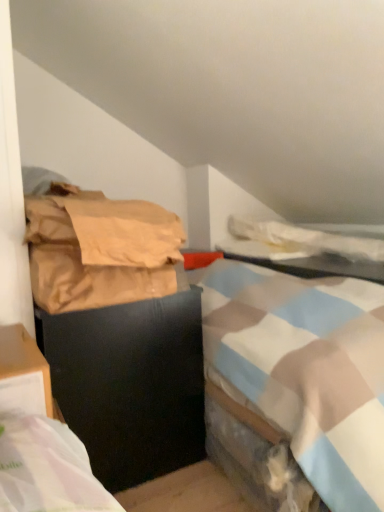
Question: Considering the relative sizes of black matte trash can at left and matte plastic table at center in the image provided, is black matte trash can at left wider than matte plastic table at center?

Choices:
 (A) yes
 (B) no

Answer: (B)

Question: Does black matte trash can at left have a greater height compared to matte plastic table at center?

Choices:
 (A) yes
 (B) no

Answer: (A)

Question: Does black matte trash can at left have a larger size compared to matte plastic table at center?

Choices:
 (A) yes
 (B) no

Answer: (A)

Question: Can you confirm if black matte trash can at left is positioned to the right of matte plastic table at center?

Choices:
 (A) no
 (B) yes

Answer: (A)

Question: From the image's perspective, is black matte trash can at left on matte plastic table at center?

Choices:
 (A) yes
 (B) no

Answer: (B)

Question: Is black matte trash can at left inside or outside of matte plastic table at center?

Choices:
 (A) outside
 (B) inside

Answer: (A)

Question: From a real-world perspective, relative to matte plastic table at center, is black matte trash can at left vertically above or below?

Choices:
 (A) below
 (B) above

Answer: (A)

Question: From the image's perspective, is black matte trash can at left positioned above or below matte plastic table at center?

Choices:
 (A) below
 (B) above

Answer: (A)

Question: Looking at the image, does black matte trash can at left seem bigger or smaller compared to matte plastic table at center?

Choices:
 (A) big
 (B) small

Answer: (A)

Question: Is white soft blanket at upper right wider or thinner than matte plastic table at center?

Choices:
 (A) thin
 (B) wide

Answer: (B)

Question: In terms of height, does white soft blanket at upper right look taller or shorter compared to matte plastic table at center?

Choices:
 (A) tall
 (B) short

Answer: (A)

Question: Relative to matte plastic table at center, is white soft blanket at upper right in front or behind?

Choices:
 (A) front
 (B) behind

Answer: (B)

Question: From a real-world perspective, is white soft blanket at upper right above or below matte plastic table at center?

Choices:
 (A) above
 (B) below

Answer: (A)

Question: Considering the positions of brown paper bag at left and black matte trash can at left in the image, is brown paper bag at left taller or shorter than black matte trash can at left?

Choices:
 (A) short
 (B) tall

Answer: (A)

Question: From a real-world perspective, is brown paper bag at left positioned above or below black matte trash can at left?

Choices:
 (A) above
 (B) below

Answer: (A)